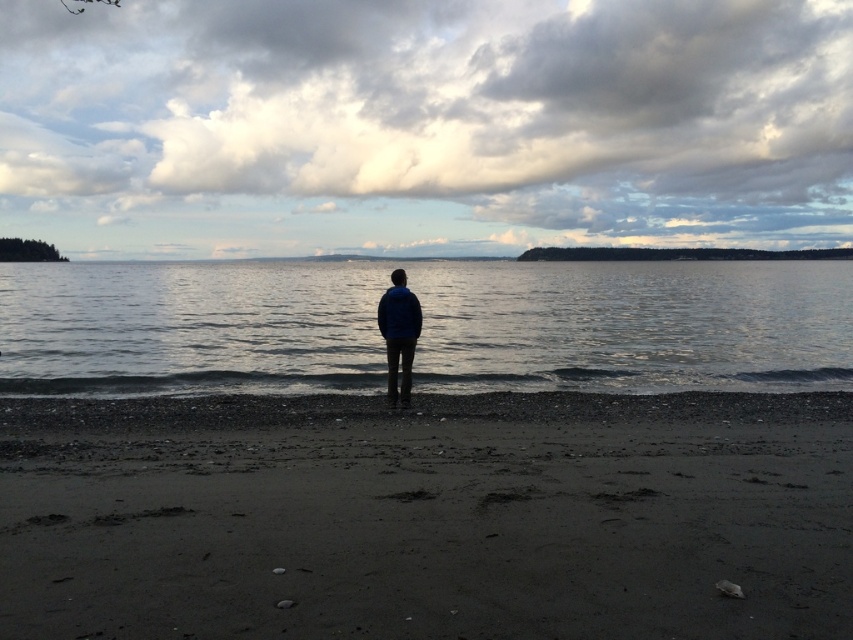
Question: Can you confirm if dark sand at center is thinner than clear water at center?

Choices:
 (A) no
 (B) yes

Answer: (B)

Question: Which object is the closest to the clear water at center?

Choices:
 (A) dark sand at center
 (B) blue matte jacket at center

Answer: (B)

Question: In this image, where is clear water at center located relative to blue matte jacket at center?

Choices:
 (A) above
 (B) below

Answer: (A)

Question: Can you confirm if dark sand at center is positioned below clear water at center?

Choices:
 (A) yes
 (B) no

Answer: (A)

Question: Which of the following is the farthest from the observer?

Choices:
 (A) (732, 268)
 (B) (131, 515)

Answer: (A)

Question: Which object appears closest to the camera in this image?

Choices:
 (A) clear water at center
 (B) dark sand at center
 (C) blue matte jacket at center

Answer: (B)